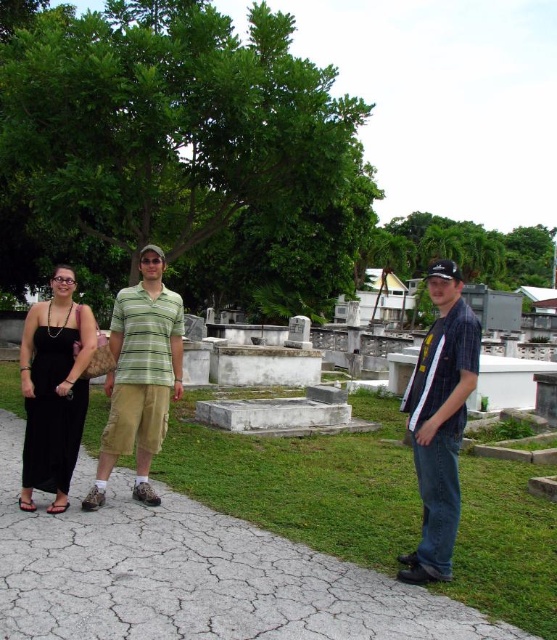
Question: Does striped cotton shirt at center appear under green striped shirt at center?

Choices:
 (A) no
 (B) yes

Answer: (B)

Question: Which of the following is the closest to the observer?

Choices:
 (A) black satin dress at left
 (B) green striped shirt at center
 (C) striped cotton shirt at center
 (D) cracked concrete path at center

Answer: (D)

Question: Does green striped shirt at center come behind black satin dress at left?

Choices:
 (A) yes
 (B) no

Answer: (A)

Question: Which object is the farthest from the black satin dress at left?

Choices:
 (A) striped cotton shirt at center
 (B) cracked concrete path at center

Answer: (A)

Question: Does striped cotton shirt at center have a lesser width compared to green striped shirt at center?

Choices:
 (A) yes
 (B) no

Answer: (B)

Question: Among these points, which one is nearest to the camera?

Choices:
 (A) (307, 625)
 (B) (48, 461)
 (C) (424, 348)
 (D) (154, 300)

Answer: (A)